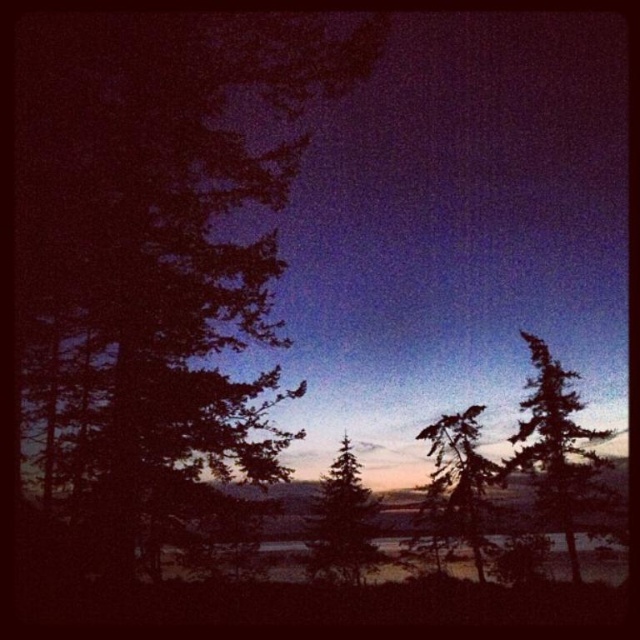
Question: From the image, what is the correct spatial relationship of green matte tree at right in relation to silvery pine tree at center?

Choices:
 (A) below
 (B) above

Answer: (B)

Question: Does green matte tree at right have a smaller size compared to silvery pine tree at center?

Choices:
 (A) yes
 (B) no

Answer: (B)

Question: From the image, what is the correct spatial relationship of green matte tree at right in relation to transparent water at center?

Choices:
 (A) above
 (B) below

Answer: (A)

Question: Which of the following is the closest to the observer?

Choices:
 (A) green matte tree at right
 (B) silhouetted evergreen tree at center

Answer: (A)

Question: Which object appears farthest from the camera in this image?

Choices:
 (A) green matte tree at right
 (B) transparent water at center
 (C) silvery pine tree at center

Answer: (C)

Question: Which object is farther from the camera taking this photo?

Choices:
 (A) silhouetted evergreen tree at center
 (B) silvery pine tree at center
 (C) transparent water at center
 (D) green matte tree at right

Answer: (B)